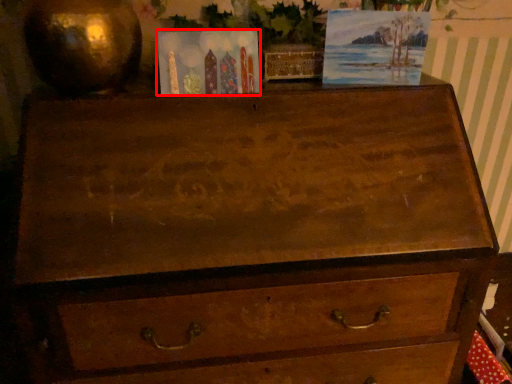
Question: From the image's perspective, where is postcard (annotated by the red box) located in relation to picture frame in the image?

Choices:
 (A) above
 (B) below

Answer: (B)